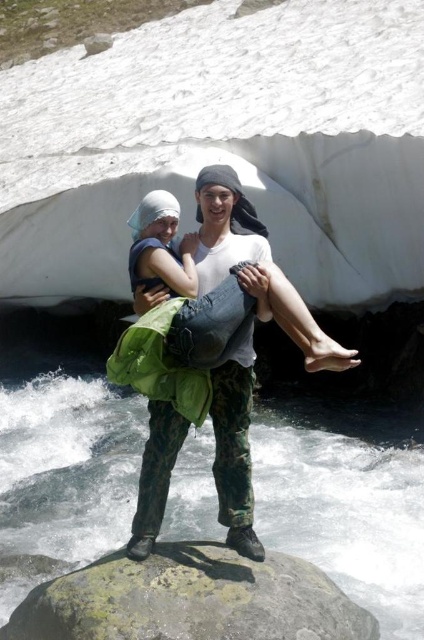
You are a photographer trying to capture the scene with a camera that has a limited field of view. You want to ensure both the gray rough rock at center and the light green fabric skirt at center are fully visible in the frame. Given their sizes, which object might require you to adjust your framing more to include it?

The light green fabric skirt at center requires more adjustment because it occupies more space than the gray rough rock at center, so you need to widen the frame to include its larger size.

You are a photographer trying to capture the scene with the gray rough rock at center and the light green fabric skirt at center. Which object should you focus on first if you want to ensure both are in sharp focus?

The gray rough rock at center is to the left of light green fabric skirt at center. Since they are both at the center, focusing on the gray rough rock at center first would ensure the light green fabric skirt at center is also in focus due to their proximity.

You are standing at the edge of the river and want to cross to the other side. You see a gray rough rock at center and a light green fabric skirt at center. Which object is closer to the water surface?

The gray rough rock at center is below the light green fabric skirt at center, so the gray rough rock at center is closer to the water surface.